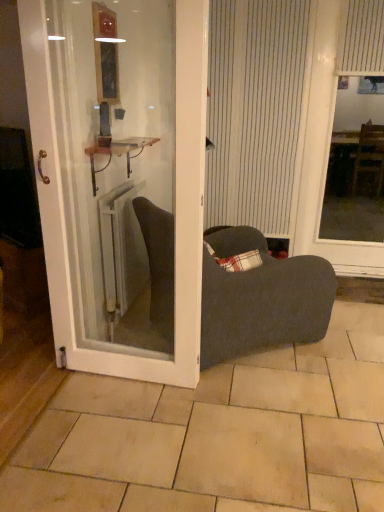
At what (x,y) coordinates should I click in order to perform the action: click on vacant area that is in front of white glossy door at center. Please return your answer as a coordinate pair (x, y). Image resolution: width=384 pixels, height=512 pixels. Looking at the image, I should click on (110, 440).